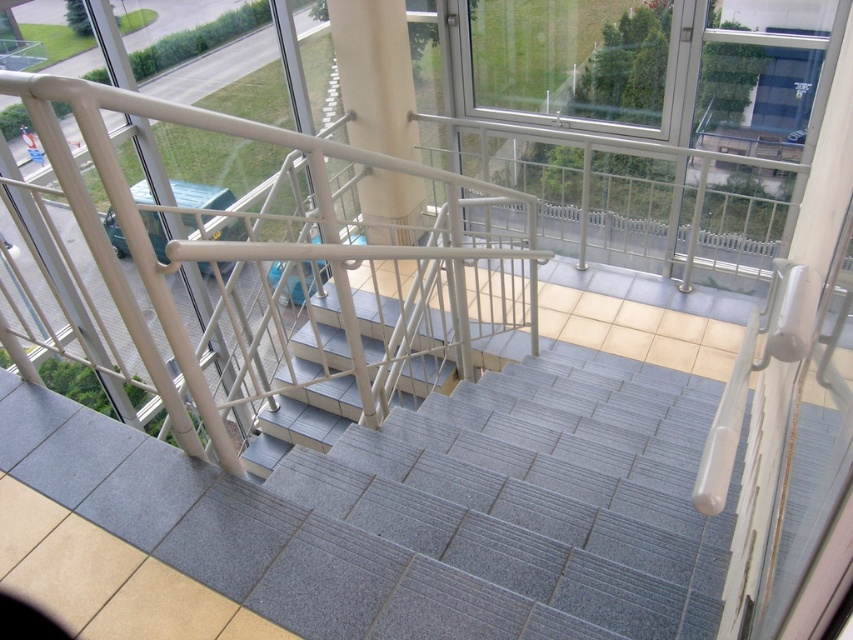
Question: Can you confirm if white glossy pillar at center is positioned above gray textured stairs at center?

Choices:
 (A) no
 (B) yes

Answer: (B)

Question: Where is white glossy pillar at center located in relation to gray textured stairs at center in the image?

Choices:
 (A) above
 (B) below

Answer: (A)

Question: Does white glossy pillar at center lie behind gray textured stairs at center?

Choices:
 (A) yes
 (B) no

Answer: (A)

Question: Which of the following is the farthest from the observer?

Choices:
 (A) gray textured stairs at center
 (B) transparent glass window at upper center
 (C) white glossy pillar at center

Answer: (C)

Question: Which point appears closest to the camera in this image?

Choices:
 (A) (386, 323)
 (B) (679, 93)

Answer: (B)

Question: Which is farther from the gray textured stairs at center?

Choices:
 (A) transparent glass window at upper center
 (B) white glossy pillar at center

Answer: (A)